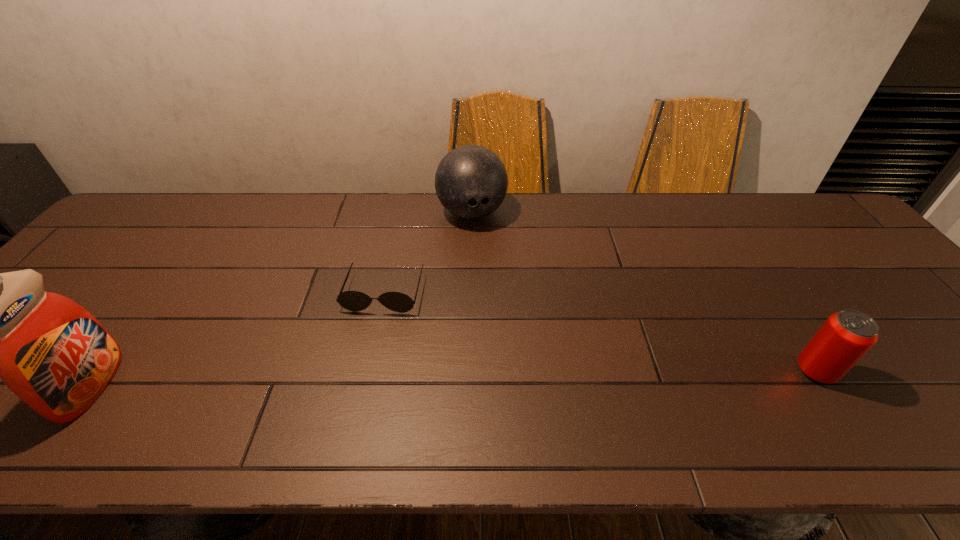
Locate an element on the screen. The height and width of the screenshot is (540, 960). the leftmost object is located at coordinates (52, 353).

The width and height of the screenshot is (960, 540). I want to click on detergent, so click(52, 353).

Locate an element on the screen. the rightmost object is located at coordinates (846, 336).

Locate an element on the screen. can is located at coordinates (846, 336).

Where is `the shortest object`? the shortest object is located at coordinates (355, 301).

In order to click on the third nearest object in this screenshot , I will do `click(355, 301)`.

Where is `the farthest object`? the farthest object is located at coordinates (471, 181).

You are a GUI agent. You are given a task and a screenshot of the screen. Output one action in this format:
    pyautogui.click(x=<x>, y=<y>)
    Task: Click on the third shortest object
    
    Given the screenshot: What is the action you would take?
    pyautogui.click(x=471, y=181)

At what (x,y) coordinates should I click in order to perform the action: click on vacant region located 0.310m on the front surface of the leftmost object. Please return your answer as a coordinate pair (x, y). Looking at the image, I should click on [x=256, y=385].

You are a GUI agent. You are given a task and a screenshot of the screen. Output one action in this format:
    pyautogui.click(x=<x>, y=<y>)
    Task: Click on the vacant space situated on the back of the third tallest object
    
    Given the screenshot: What is the action you would take?
    pyautogui.click(x=788, y=328)